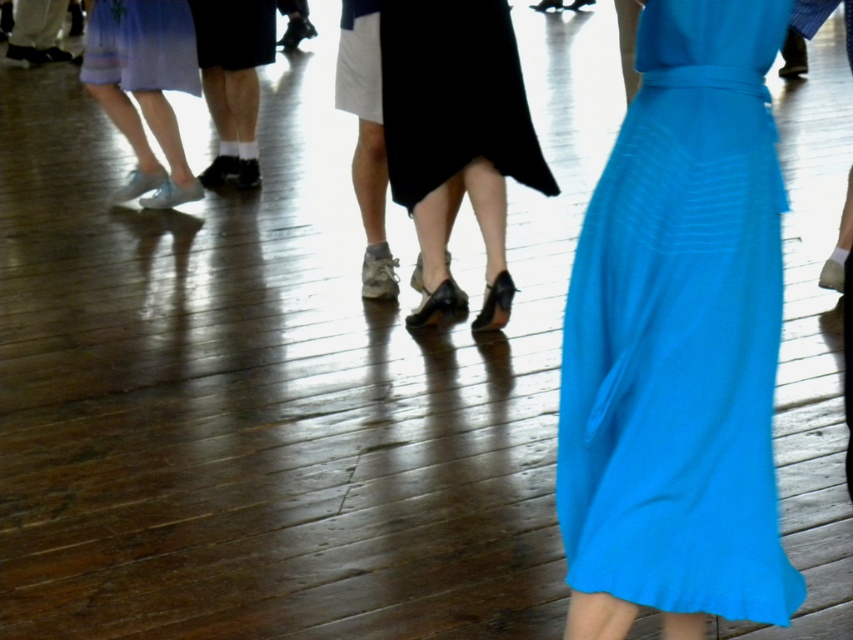
You are a photographer at the event and want to capture a shot of the matte white sneakers at lower left and the matte black skirt at center. From the perspective of the camera, which object is positioned to the left?

The matte white sneakers at lower left are to the left of the matte black skirt at center, so from the camera perspective, the matte white sneakers at lower left would be on the left side of the frame.

You are a photographer standing at the origin point of the coordinate system. You want to capture a photo of both the point at (165, 132) and the point at (213, 35) in the same frame. Which point should you focus on first to ensure both are in focus?

You should focus on the point at (165, 132) first because it is closer to you than the point at (213, 35), ensuring both will be in focus when using a shallow depth of field.

You are standing at the point labeled as point (103, 22) in the image. You want to throw a small object to a friend who is standing exactly where you are. However, you need to ensure that the object travels no more than 6 meters to reach them. Can you do this?

The distance between point (103, 22) and the viewer is 6.13 meters. Since the required distance to throw the object is no more than 6 meters, it exceeds the limit by 0.13 meters. Therefore, you cannot do this.